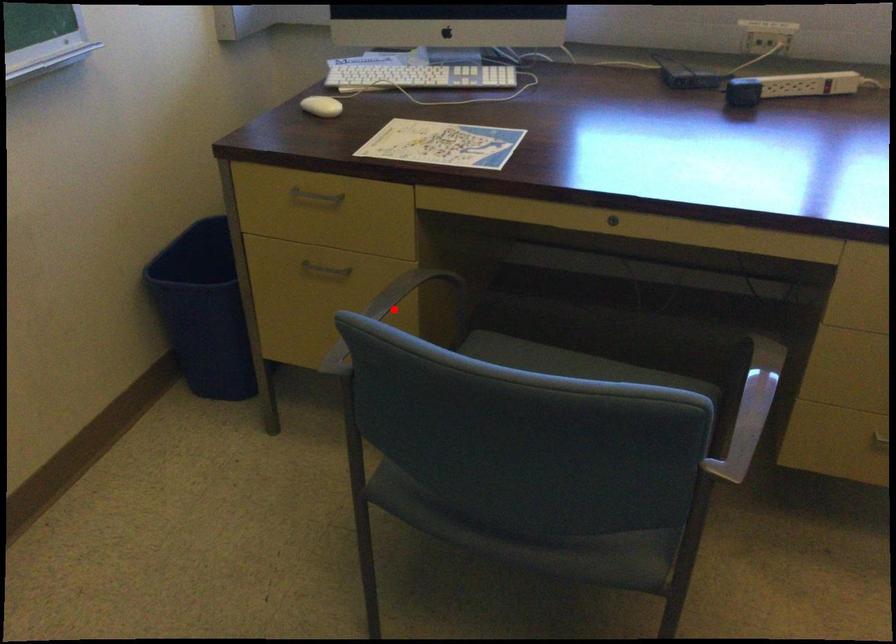
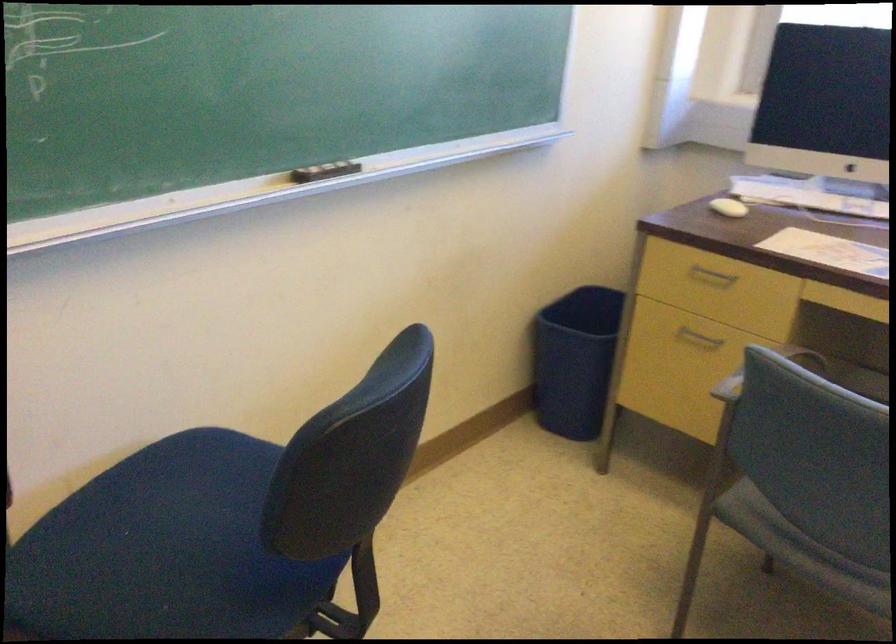
Question: I am providing you with two images of the same scene from different viewpoints. A red point is marked on the first image. Is the red point's position out of view in image 2?

Choices:
 (A) Yes
 (B) No

Answer: (A)